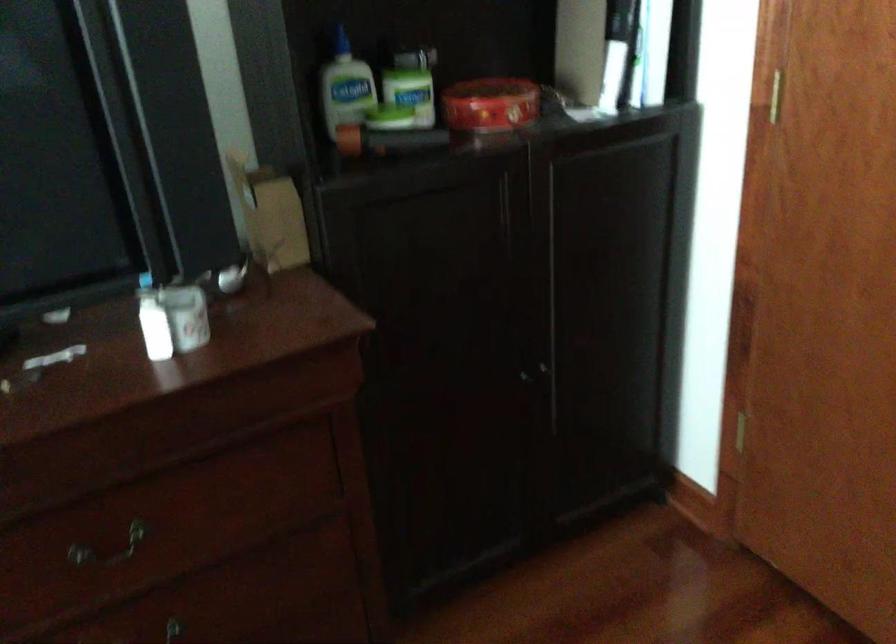
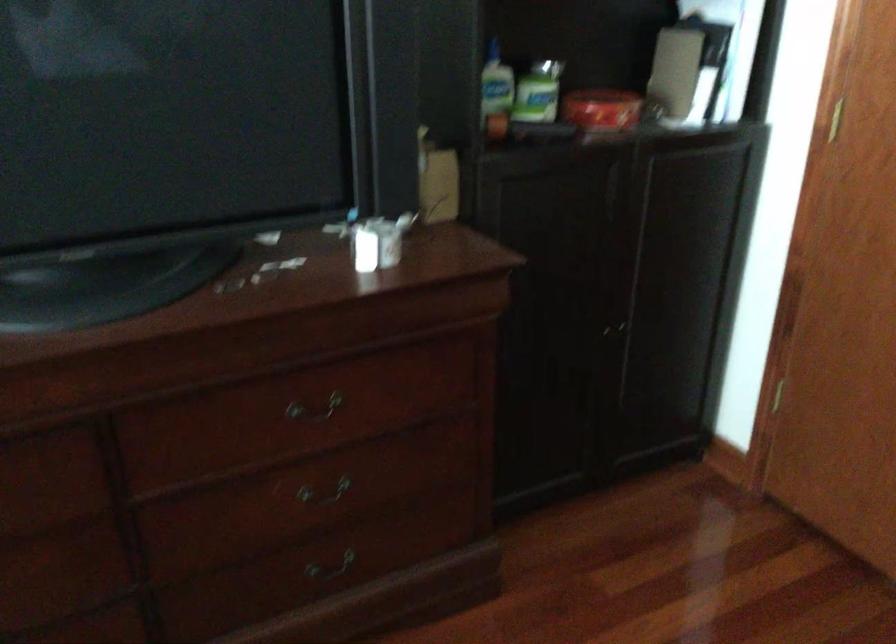
In the second image, find the point that corresponds to point (410, 96) in the first image.

(538, 91)